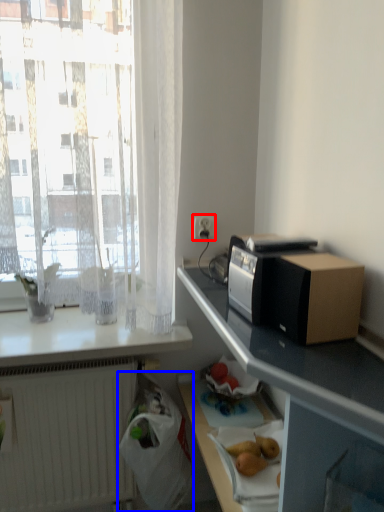
Question: Which object appears closest to the camera in this image, electric outlet (highlighted by a red box) or shopping bag (highlighted by a blue box)?

Choices:
 (A) electric outlet
 (B) shopping bag

Answer: (B)